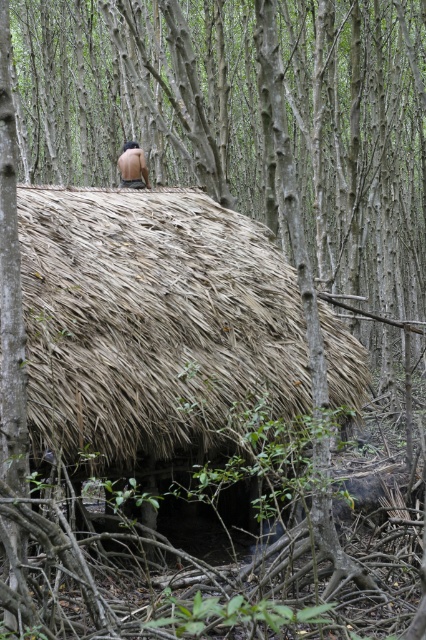
Does brown thatch roof at center appear on the left side of brown leather back at center?

No, brown thatch roof at center is not to the left of brown leather back at center.

Does point (101, 220) come in front of point (141, 161)?

Yes, point (101, 220) is in front of point (141, 161).

Identify the location of brown thatch roof at center. The image size is (426, 640). (152, 321).